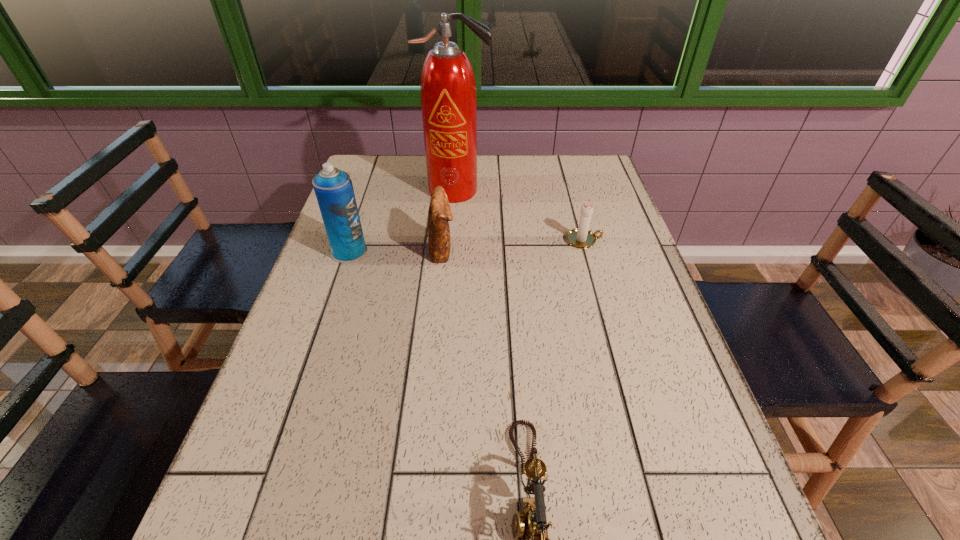
You are a GUI agent. You are given a task and a screenshot of the screen. Output one action in this format:
    pyautogui.click(x=<x>, y=<y>)
    Task: Click on the vacant point located between the leftmost object and the farthest object
    
    Given the screenshot: What is the action you would take?
    pyautogui.click(x=403, y=221)

Identify the location of empty space between the leftmost object and the candle holder. (467, 246).

Identify which object is the second nearest to the fire extinguisher. Please provide its 2D coordinates. Your answer should be formatted as a tuple, i.e. [(x, y)], where the tuple contains the x and y coordinates of a point satisfying the conditions above.

[(334, 191)]

Point out which object is positioned as the third nearest to the clutch bag. Please provide its 2D coordinates. Your answer should be formatted as a tuple, i.e. [(x, y)], where the tuple contains the x and y coordinates of a point satisfying the conditions above.

[(581, 237)]

The height and width of the screenshot is (540, 960). I want to click on vacant region that satisfies the following two spatial constraints: 1. on the open side of the third tallest object; 2. on the front side of the leftmost object, so click(x=443, y=252).

At what (x,y) coordinates should I click in order to perform the action: click on vacant point that satisfies the following two spatial constraints: 1. on the handle side of the rightmost object; 2. on the front side of the fourth shortest object. Please return your answer as a coordinate pair (x, y). Looking at the image, I should click on (587, 252).